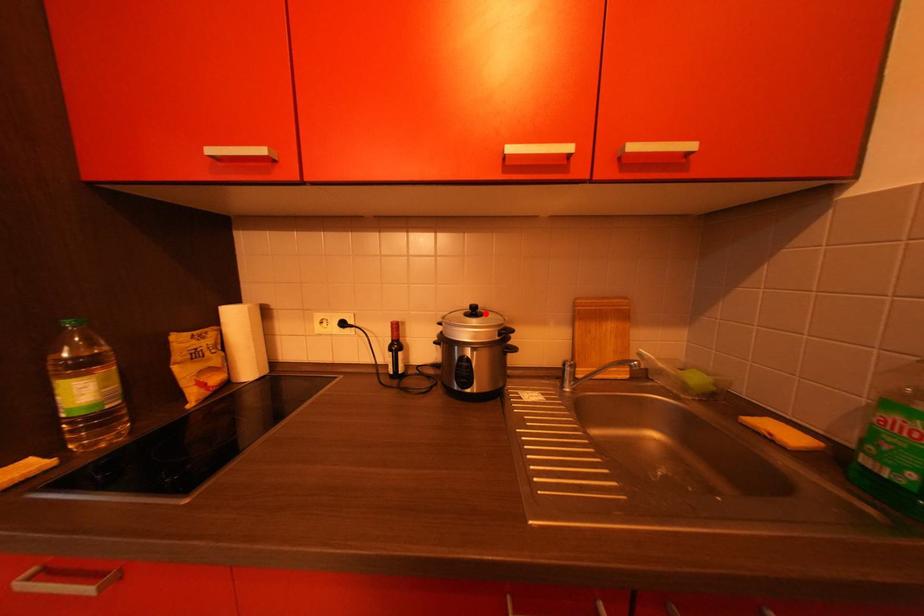
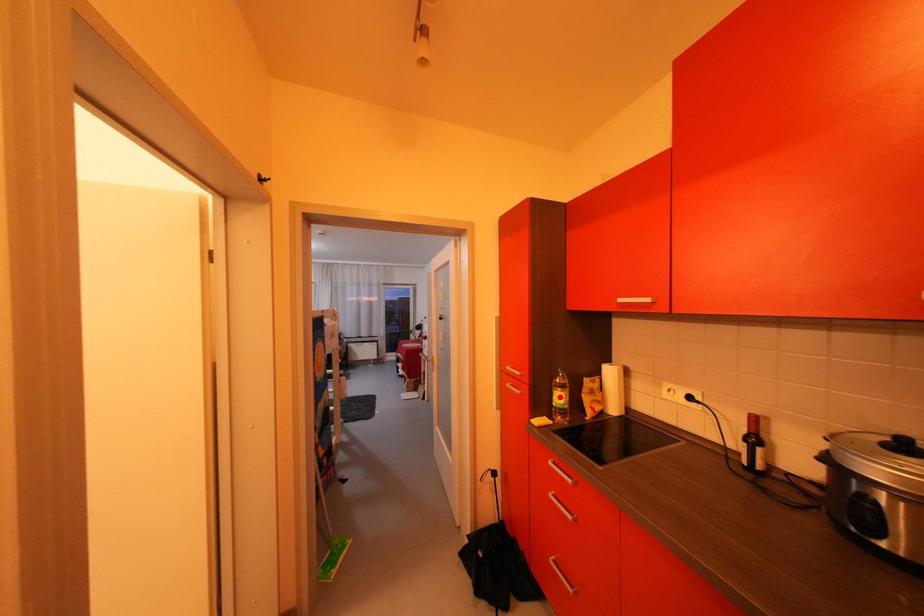
I am providing you with two images of the same scene from different viewpoints. A red point is marked on the first image and another point is marked on the second image. Are the points marked in image1 and image2 representing the same 3D position?

No